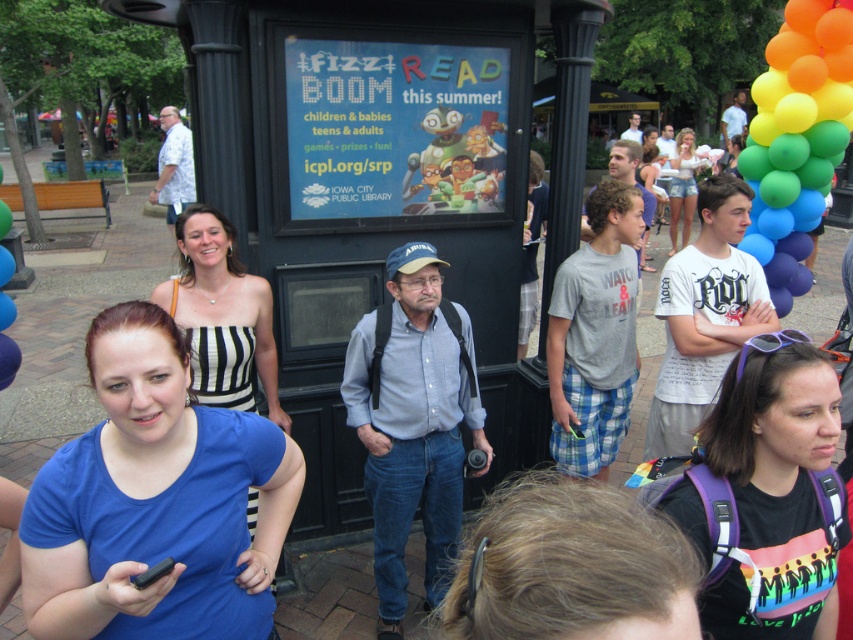
You are at the event and want to take a photo of the blue cotton shirt at center and the rainbow balloons at right. Which object should you focus on first if you want to include both in your shot without moving the camera?

The blue cotton shirt at center is positioned on the left side of rainbow balloons at right, so you should focus on the blue cotton shirt at center first to ensure both are in frame.

You are at the event and want to take a photo of both the blue cotton shirt at center and the rainbow balloons at right. Which object should you focus on first if you want to capture both in the same frame without moving the camera?

You should focus on the blue cotton shirt at center first because it is shorter than the rainbow balloons at right, allowing you to adjust the camera angle to include both in the frame.